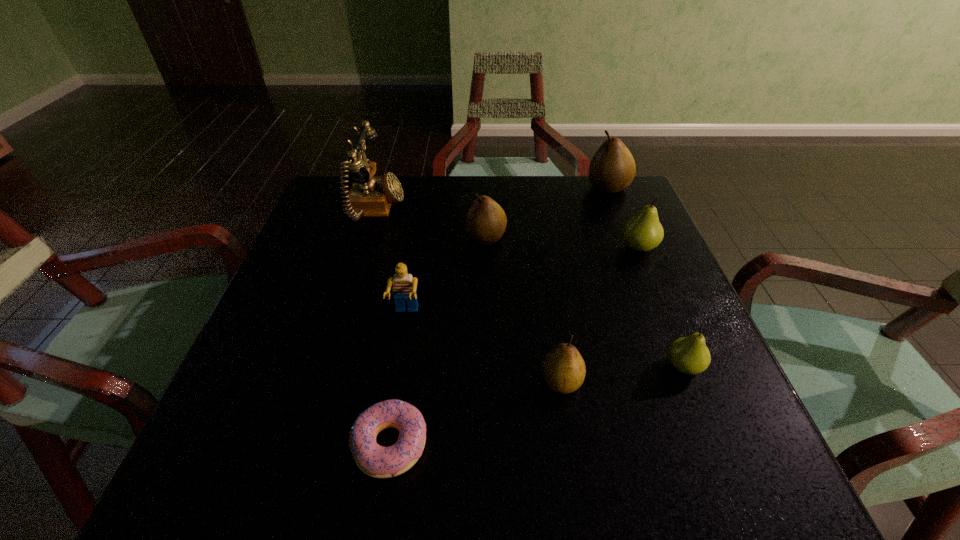
Identify the location of vacant region between the doughnut and the smaller green pear. Image resolution: width=960 pixels, height=540 pixels. (537, 405).

The image size is (960, 540). Identify the location of free space between the tallest object and the farther green pear. (507, 228).

You are a GUI agent. You are given a task and a screenshot of the screen. Output one action in this format:
    pyautogui.click(x=<x>, y=<y>)
    Task: Click on the free spot between the smallest brown pear and the doughnut
    The image size is (960, 540).
    Given the screenshot: What is the action you would take?
    475,413

Where is `vacant point located between the fourth object from right to left and the nearer green pear`? The image size is (960, 540). vacant point located between the fourth object from right to left and the nearer green pear is located at coordinates (623, 374).

Where is `object that is the seventh closest to the second smallest brown pear`? object that is the seventh closest to the second smallest brown pear is located at coordinates (374, 460).

The height and width of the screenshot is (540, 960). I want to click on the sixth closest object to the telephone, so tap(643, 232).

Point out which pear is positioned as the second nearest to the leftmost pear. Please provide its 2D coordinates. Your answer should be formatted as a tuple, i.e. [(x, y)], where the tuple contains the x and y coordinates of a point satisfying the conditions above.

[(643, 232)]

Identify which pear is the second closest to the smaller green pear. Please provide its 2D coordinates. Your answer should be formatted as a tuple, i.e. [(x, y)], where the tuple contains the x and y coordinates of a point satisfying the conditions above.

[(643, 232)]

The image size is (960, 540). Find the location of `the closest brown pear to the nearer green pear`. the closest brown pear to the nearer green pear is located at coordinates (563, 368).

Point out which brown pear is positioned as the second nearest to the seventh shortest object. Please provide its 2D coordinates. Your answer should be formatted as a tuple, i.e. [(x, y)], where the tuple contains the x and y coordinates of a point satisfying the conditions above.

[(563, 368)]